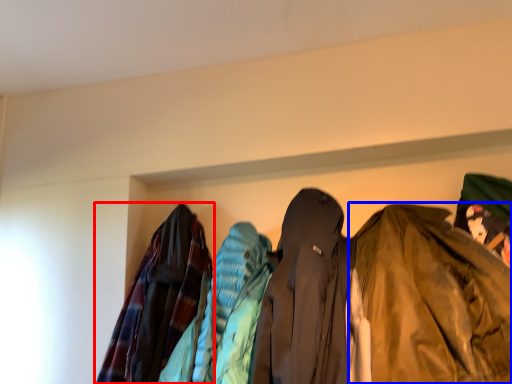
Question: Among these objects, which one is nearest to the camera, jacket (highlighted by a red box) or jacket (highlighted by a blue box)?

Choices:
 (A) jacket
 (B) jacket

Answer: (B)